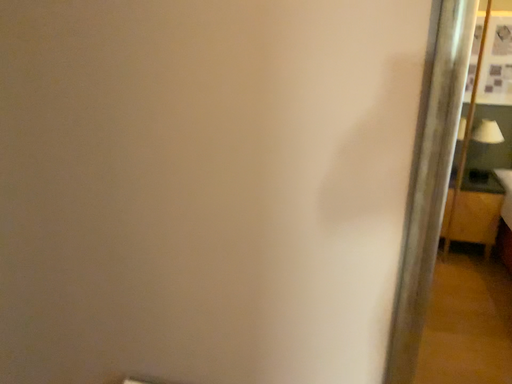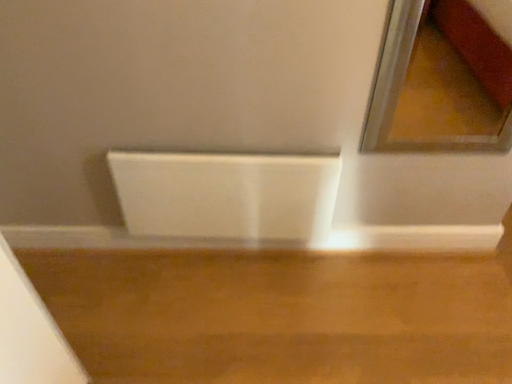
Question: How did the camera likely rotate when shooting the video?

Choices:
 (A) rotated downward
 (B) rotated upward

Answer: (A)